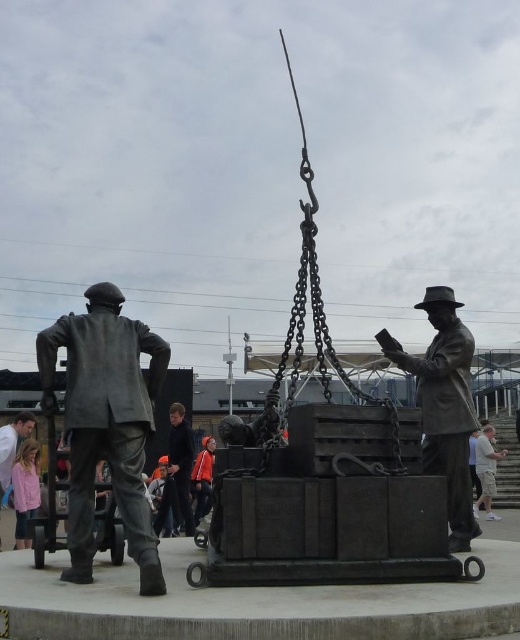
The image size is (520, 640). Describe the element at coordinates (444, 404) in the screenshot. I see `bronze statue at right` at that location.

Which is behind, point (433, 392) or point (24, 545)?

Point (24, 545)

Locate an element on the screen. bronze statue at right is located at coordinates (444, 404).

You are a GUI agent. You are given a task and a screenshot of the screen. Output one action in this format:
    pyautogui.click(x=<x>, y=<y>)
    Task: Click on the bronze statue at right
    The image size is (520, 640).
    Given the screenshot: What is the action you would take?
    pyautogui.click(x=444, y=404)

From the picture: Does bronze statue at center have a smaller size compared to pink fabric at lower left?

No.

Between bronze statue at center and pink fabric at lower left, which one is positioned lower?

pink fabric at lower left is below.

The image size is (520, 640). I want to click on bronze statue at center, so click(344, 460).

The width and height of the screenshot is (520, 640). Find the location of `bronze statue at center`. bronze statue at center is located at coordinates (344, 460).

Measure the distance between point (474, 536) and camera.

A distance of 39.44 feet exists between point (474, 536) and camera.

Does point (405, 470) come behind point (200, 506)?

No, (405, 470) is in front of (200, 506).

Which is in front, point (297, 372) or point (193, 476)?

Positioned in front is point (297, 372).

In order to click on bronze statue at center in this screenshot , I will do `click(344, 460)`.